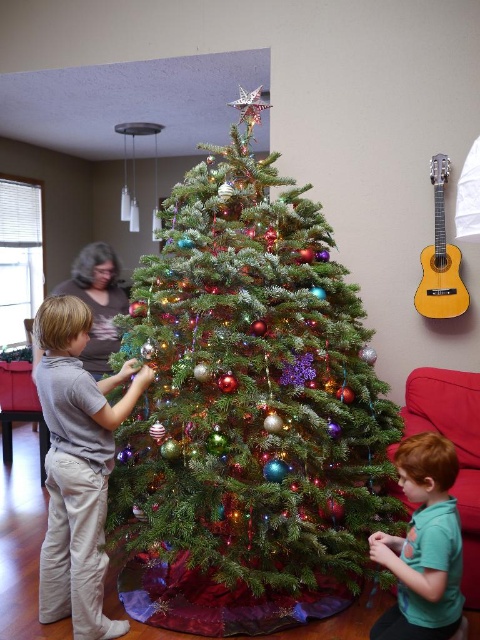
Who is lower down, green matte christmas tree at center or yellow wood guitar at upper right?

green matte christmas tree at center is below.

Does green matte christmas tree at center appear on the left side of yellow wood guitar at upper right?

Yes, green matte christmas tree at center is to the left of yellow wood guitar at upper right.

Does point (231, 234) come in front of point (448, 257)?

Yes, point (231, 234) is in front of point (448, 257).

The image size is (480, 640). Find the location of `green matte christmas tree at center`. green matte christmas tree at center is located at coordinates (251, 394).

Which is above, green matte christmas tree at center or green matte shirt at lower right?

Result: Positioned higher is green matte christmas tree at center.

Is green matte christmas tree at center shorter than green matte shirt at lower right?

In fact, green matte christmas tree at center may be taller than green matte shirt at lower right.

Locate an element on the screen. green matte christmas tree at center is located at coordinates (251, 394).

Who is positioned more to the left, green matte shirt at lower right or yellow wood guitar at upper right?

From the viewer's perspective, green matte shirt at lower right appears more on the left side.

What do you see at coordinates (423, 545) in the screenshot? I see `green matte shirt at lower right` at bounding box center [423, 545].

The height and width of the screenshot is (640, 480). Find the location of `green matte shirt at lower right`. green matte shirt at lower right is located at coordinates (423, 545).